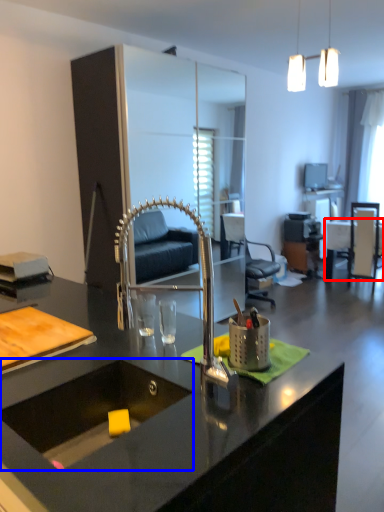
Question: Among these objects, which one is farthest to the camera, table (highlighted by a red box) or sink (highlighted by a blue box)?

Choices:
 (A) table
 (B) sink

Answer: (A)